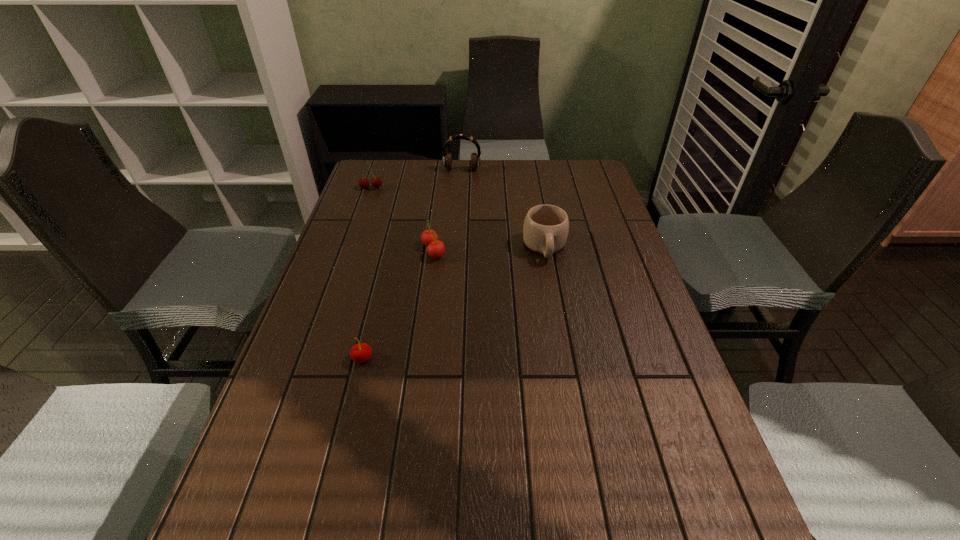
Where is `vacant space that is in between the fourth object from right to left and the tallest object`? vacant space that is in between the fourth object from right to left and the tallest object is located at coordinates (412, 264).

At what (x,y) coordinates should I click in order to perform the action: click on free space between the tallest object and the rightmost cherry. Please return your answer as a coordinate pair (x, y). Image resolution: width=960 pixels, height=540 pixels. Looking at the image, I should click on (447, 211).

The image size is (960, 540). What are the coordinates of `free point between the fourth object from right to left and the farthest object` in the screenshot? It's located at (412, 264).

What are the coordinates of `unoccupied area between the rightmost object and the farthest object` in the screenshot? It's located at pos(503,208).

Where is `vacant space that is in between the fourth object from right to left and the mug`? Image resolution: width=960 pixels, height=540 pixels. vacant space that is in between the fourth object from right to left and the mug is located at coordinates (454, 303).

Locate an element on the screen. This screenshot has height=540, width=960. vacant space that is in between the farthest object and the rightmost object is located at coordinates (503, 208).

At what (x,y) coordinates should I click in order to perform the action: click on empty space between the nearest cherry and the second farthest object. Please return your answer as a coordinate pair (x, y). Looking at the image, I should click on (367, 273).

Identify the location of vacant space that is in between the second farthest cherry and the second object from left to right. The height and width of the screenshot is (540, 960). (398, 305).

At what (x,y) coordinates should I click in order to perform the action: click on free spot between the rightmost object and the leftmost object. Please return your answer as a coordinate pair (x, y). Looking at the image, I should click on (458, 218).

The height and width of the screenshot is (540, 960). What are the coordinates of `free spot between the nearest object and the second farthest cherry` in the screenshot? It's located at (398, 305).